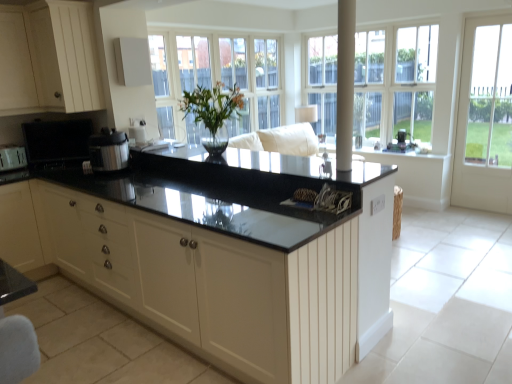
At what (x,y) coordinates should I click in order to perform the action: click on vacant area on top of black granite countertop at center, arranged as the 2th countertop when ordered from the bottom (from a real-world perspective). Please return your answer as a coordinate pair (x, y). The width and height of the screenshot is (512, 384). Looking at the image, I should click on (202, 155).